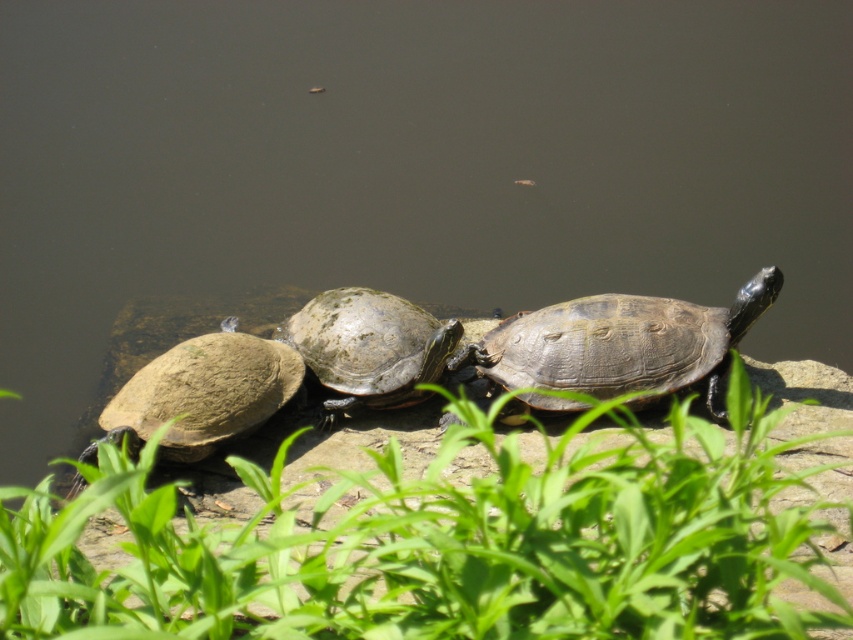
Question: Based on their relative distances, which object is farther from the green leafy grass at center?

Choices:
 (A) brown matte tortoise at left
 (B) greenish-brown textured shell at center

Answer: (B)

Question: Considering the real-world distances, which object is farthest from the green leafy grass at center?

Choices:
 (A) shiny dark brown tortoise at center
 (B) greenish-brown textured shell at center
 (C) brown matte tortoise at left

Answer: (B)

Question: Is shiny dark brown tortoise at center to the left of greenish-brown textured shell at center from the viewer's perspective?

Choices:
 (A) no
 (B) yes

Answer: (A)

Question: Does green leafy grass at center appear on the left side of brown matte tortoise at left?

Choices:
 (A) no
 (B) yes

Answer: (A)

Question: Which of these objects is positioned closest to the greenish-brown textured shell at center?

Choices:
 (A) brown matte tortoise at left
 (B) green leafy grass at center

Answer: (A)

Question: Is green leafy grass at center thinner than greenish-brown textured shell at center?

Choices:
 (A) yes
 (B) no

Answer: (B)